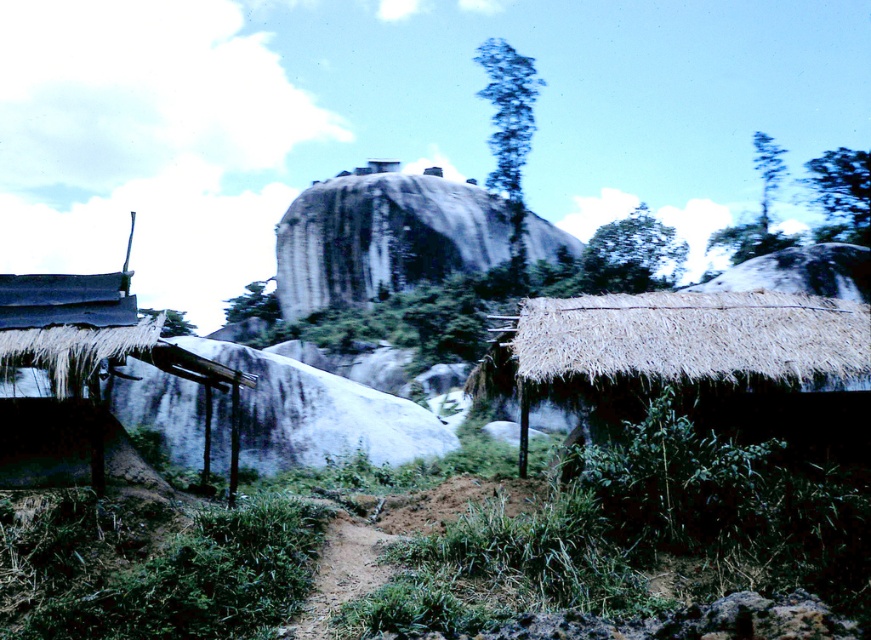
Is thatched straw hut at lower right bigger than dark gray thatched roof at left?

Incorrect, thatched straw hut at lower right is not larger than dark gray thatched roof at left.

Which is more to the right, thatched straw hut at lower right or dark gray thatched roof at left?

thatched straw hut at lower right is more to the right.

Is point (559, 333) farther from camera compared to point (102, 342)?

Yes, it is.

Identify the location of thatched straw hut at lower right. (701, 360).

Can you confirm if rough stone mountain at center is wider than dark gray thatched roof at left?

Yes.

Can you confirm if rough stone mountain at center is bigger than dark gray thatched roof at left?

Correct, rough stone mountain at center is larger in size than dark gray thatched roof at left.

At what (x,y) coordinates should I click in order to perform the action: click on rough stone mountain at center. Please return your answer as a coordinate pair (x, y). Looking at the image, I should click on (382, 236).

Is thatched straw hut at lower right closer to the viewer compared to rough stone mountain at center?

Yes, it is in front of rough stone mountain at center.

Which of these two, thatched straw hut at lower right or rough stone mountain at center, stands shorter?

Standing shorter between the two is thatched straw hut at lower right.

Is point (827, 428) more distant than point (458, 195)?

No, it is in front of (458, 195).

This screenshot has height=640, width=871. I want to click on thatched straw hut at lower right, so click(701, 360).